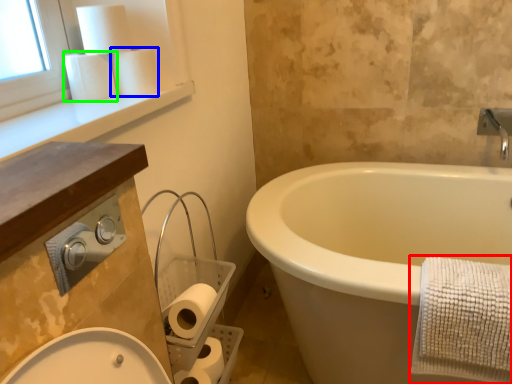
Question: Which object is the farthest from bath towel (highlighted by a red box)? Choose among these: toilet paper (highlighted by a blue box) or toilet paper (highlighted by a green box).

Choices:
 (A) toilet paper
 (B) toilet paper

Answer: (B)